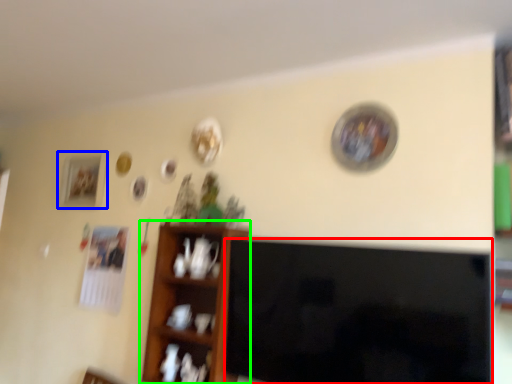
Question: Considering the real-world distances, which object is farthest from television (highlighted by a red box)? picture frame (highlighted by a blue box) or shelf (highlighted by a green box)?

Choices:
 (A) picture frame
 (B) shelf

Answer: (A)